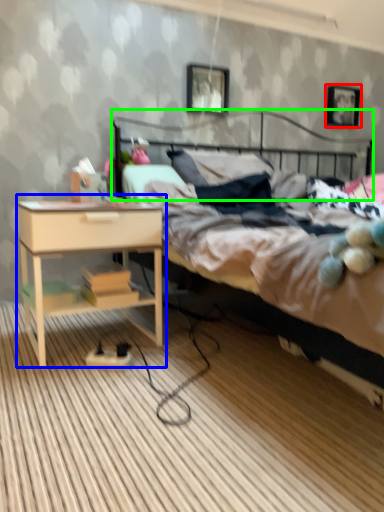
Question: Which object is the farthest from picture frame (highlighted by a red box)? Choose among these: nightstand (highlighted by a blue box) or headboard (highlighted by a green box).

Choices:
 (A) nightstand
 (B) headboard

Answer: (A)